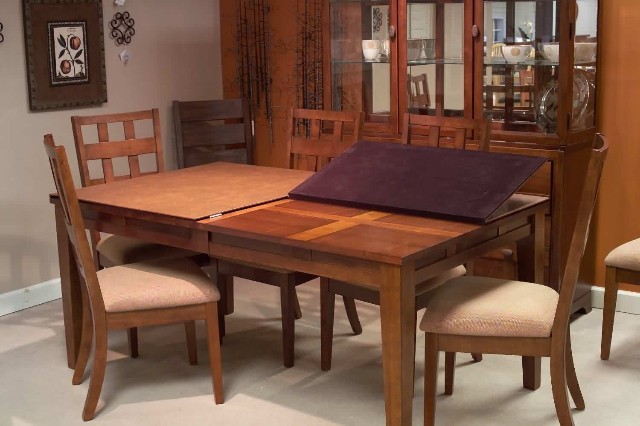
You are a GUI agent. You are given a task and a screenshot of the screen. Output one action in this format:
    pyautogui.click(x=<x>, y=<y>)
    Task: Click on the cabinet doors
    
    Given the screenshot: What is the action you would take?
    pyautogui.click(x=397, y=82), pyautogui.click(x=479, y=78)